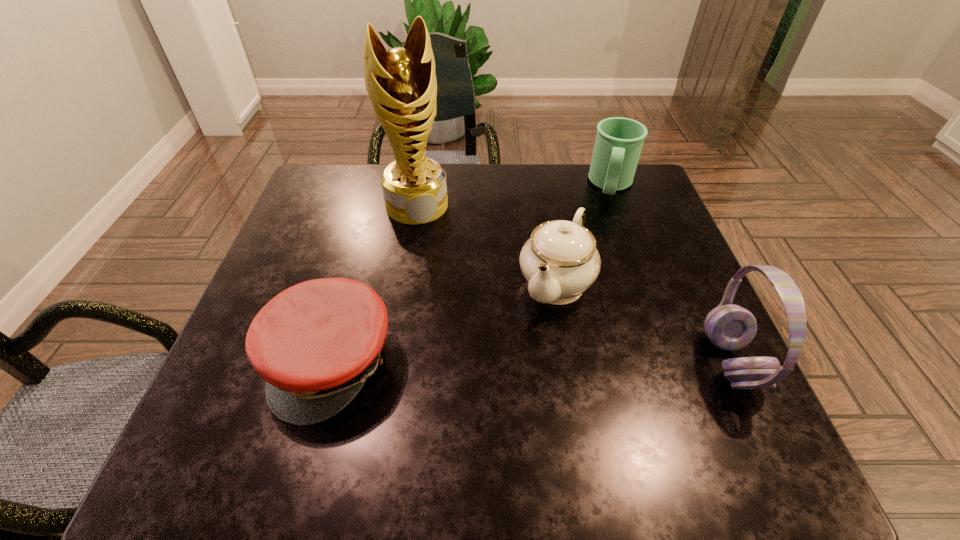
Identify the location of vacant space on the desktop that is between the shortest object and the fourth shortest object and is positioned on the side of the mug with the handle. Image resolution: width=960 pixels, height=540 pixels. (586, 362).

The image size is (960, 540). What are the coordinates of `vacant space on the desktop that is between the cap and the fourth shortest object and is positioned on the front-facing side of the tallest object` in the screenshot? It's located at click(x=474, y=362).

You are a GUI agent. You are given a task and a screenshot of the screen. Output one action in this format:
    pyautogui.click(x=<x>, y=<y>)
    Task: Click on the vacant space on the desktop that is between the cap and the headset and is positioned at the spout of the third object from right to left
    
    Given the screenshot: What is the action you would take?
    pyautogui.click(x=510, y=362)